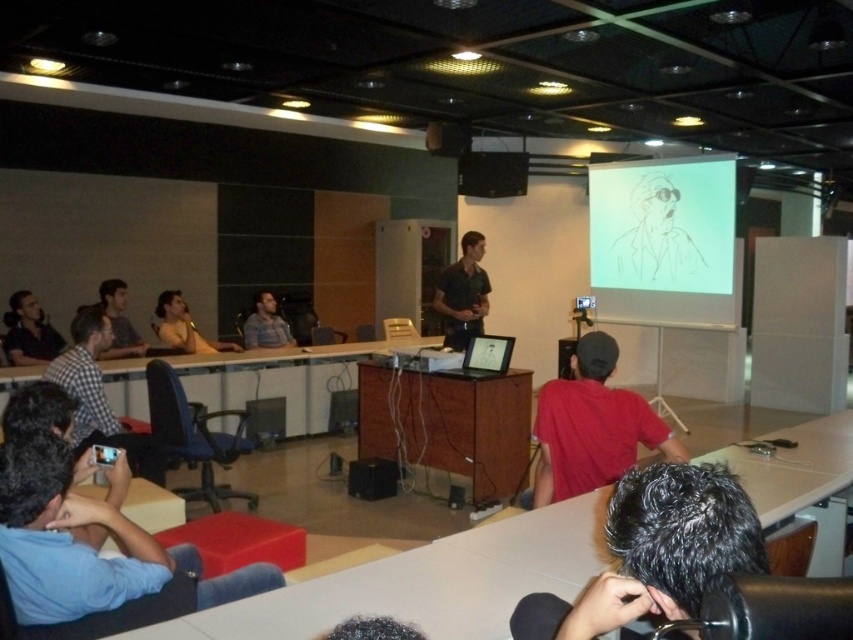
Question: Which of these objects is positioned farthest from the white paper at upper center?

Choices:
 (A) red matte shirt at lower right
 (B) matte black shirt at left

Answer: (B)

Question: Is white paper at upper center further to the viewer compared to matte black shirt at center?

Choices:
 (A) no
 (B) yes

Answer: (B)

Question: Does white paper at upper center have a greater width compared to red matte shirt at lower right?

Choices:
 (A) no
 (B) yes

Answer: (B)

Question: Does matte black speaker at upper center have a lesser width compared to plaid fabric shirt at center?

Choices:
 (A) yes
 (B) no

Answer: (B)

Question: Which is farther from the matte black shirt at left?

Choices:
 (A) matte black speaker at upper center
 (B) red matte shirt at lower right
 (C) matte black shirt at center
 (D) plaid fabric shirt at center

Answer: (B)

Question: Among these points, which one is farthest from the camera?

Choices:
 (A) (39, 352)
 (B) (698, 195)

Answer: (B)